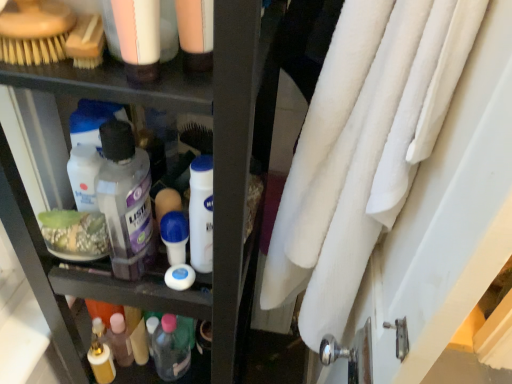
Measure the distance between transparent plastic mouthwash at center and camera.

transparent plastic mouthwash at center and camera are 23.37 inches apart.

This screenshot has width=512, height=384. What do you see at coordinates (362, 149) in the screenshot?
I see `white fluffy towel at right` at bounding box center [362, 149].

What do you see at coordinates (138, 37) in the screenshot? I see `matte plastic lotion at upper left, positioned as the 4th toiletry in bottom-to-top order` at bounding box center [138, 37].

The width and height of the screenshot is (512, 384). In order to click on blue rubber duster at center, which is the third toiletry from top to bottom in this screenshot , I will do `click(175, 236)`.

Image resolution: width=512 pixels, height=384 pixels. I want to click on green matte soap dish at center-left, placed as the second product when sorted from bottom to top, so click(75, 234).

You are a GUI agent. You are given a task and a screenshot of the screen. Output one action in this format:
    pyautogui.click(x=<x>, y=<y>)
    Task: Click on the white matte lotion at center, the 2th toiletry from the front
    Image resolution: width=512 pixels, height=384 pixels.
    Given the screenshot: What is the action you would take?
    pyautogui.click(x=201, y=213)

From the image's perspective, which is below, matte black shelf at center or white glossy deodorant at center, the 1th product from the bottom?

matte black shelf at center.

Considering the sizes of objects matte black shelf at center and white glossy deodorant at center, positioned as the 1th product in right-to-left order, in the image provided, who is thinner, matte black shelf at center or white glossy deodorant at center, positioned as the 1th product in right-to-left order,?

white glossy deodorant at center, positioned as the 1th product in right-to-left order.

Can you tell me how much matte black shelf at center and white glossy deodorant at center, marked as the 2th product in a left-to-right arrangement, differ in facing direction?

matte black shelf at center and white glossy deodorant at center, marked as the 2th product in a left-to-right arrangement, are facing 90.8 degrees away from each other.

I want to click on shelf below the white glossy deodorant at center, the 1th product from the bottom (from a real-world perspective), so click(215, 185).

Is transparent plastic mouthwash at center aimed at blue rubber duster at center, which is the third toiletry from top to bottom?

Yes, transparent plastic mouthwash at center faces towards blue rubber duster at center, which is the third toiletry from top to bottom.

From a real-world perspective, who is located lower, transparent plastic mouthwash at center or blue rubber duster at center, which is counted as the 3th toiletry, starting from the front?

blue rubber duster at center, which is counted as the 3th toiletry, starting from the front, from a real-world perspective.

Who is smaller, transparent plastic mouthwash at center or blue rubber duster at center, the 2th toiletry when ordered from back to front?

Smaller between the two is blue rubber duster at center, the 2th toiletry when ordered from back to front.

From the image's perspective, is transparent plastic mouthwash at center beneath blue rubber duster at center, which is the third toiletry from top to bottom?

No, from the image's perspective, transparent plastic mouthwash at center is not beneath blue rubber duster at center, which is the third toiletry from top to bottom.

Who is smaller, white glossy deodorant at center, the 1th product from the bottom, or blue rubber duster at center, which is counted as the 3th toiletry, starting from the front?

white glossy deodorant at center, the 1th product from the bottom, is smaller.

From the image's perspective, is white glossy deodorant at center, marked as the 2th product in a left-to-right arrangement, located above blue rubber duster at center, the second toiletry in the bottom-to-top sequence?

No, from the image's perspective, white glossy deodorant at center, marked as the 2th product in a left-to-right arrangement, is not on top of blue rubber duster at center, the second toiletry in the bottom-to-top sequence.

Looking at this image, which of these two, white glossy deodorant at center, acting as the 2th product starting from the top, or blue rubber duster at center, which is the third toiletry from top to bottom, stands shorter?

white glossy deodorant at center, acting as the 2th product starting from the top.

Can blue rubber duster at center, the 2th toiletry when ordered from back to front, be found inside white glossy deodorant at center, the 1th product from the bottom?

No, blue rubber duster at center, the 2th toiletry when ordered from back to front, is not a part of white glossy deodorant at center, the 1th product from the bottom.

Does matte black shelf at center lie behind green matte soap dish at center-left, arranged as the first product when viewed from the left?

No, matte black shelf at center is in front of green matte soap dish at center-left, arranged as the first product when viewed from the left.

How many degrees apart are the facing directions of matte black shelf at center and green matte soap dish at center-left, placed as the second product when sorted from bottom to top?

The angular difference between matte black shelf at center and green matte soap dish at center-left, placed as the second product when sorted from bottom to top, is 87.1 degrees.

Between matte black shelf at center and green matte soap dish at center-left, arranged as the first product when viewed from the left, which one has more height?

matte black shelf at center.

How distant is transparent plastic mouthwash at center from matte plastic lotion at upper left, positioned as the 4th toiletry in bottom-to-top order?

They are 24.68 centimeters apart.

From the image's perspective, which is above, transparent plastic mouthwash at center or matte plastic lotion at upper left, the fourth toiletry positioned from the back?

matte plastic lotion at upper left, the fourth toiletry positioned from the back.

Between transparent plastic mouthwash at center and matte plastic lotion at upper left, the first toiletry in the front-to-back sequence, which one is positioned behind?

transparent plastic mouthwash at center is more distant.

Is transparent plastic mouthwash at center aimed at matte plastic lotion at upper left, positioned as the 4th toiletry in bottom-to-top order?

No.

Is matte black shelf at center spatially inside matte plastic lotion at upper left, which appears as the first toiletry when viewed from the top, or outside of it?

The correct answer is: outside.

From the image's perspective, which one is positioned higher, matte black shelf at center or matte plastic lotion at upper left, the first toiletry in the front-to-back sequence?

matte plastic lotion at upper left, the first toiletry in the front-to-back sequence, from the image's perspective.

Is matte black shelf at center to the left of matte plastic lotion at upper left, which appears as the first toiletry when viewed from the top, from the viewer's perspective?

Correct, you'll find matte black shelf at center to the left of matte plastic lotion at upper left, which appears as the first toiletry when viewed from the top.

Based on the photo, between matte black shelf at center and matte plastic lotion at upper left, the first toiletry in the front-to-back sequence, which one is positioned behind?

matte plastic lotion at upper left, the first toiletry in the front-to-back sequence, is further away from the camera.

Which of these two, matte black shelf at center or white fluffy towel at right, is thinner?

white fluffy towel at right.

Would you say white fluffy towel at right is part of matte black shelf at center's contents?

Actually, white fluffy towel at right is outside matte black shelf at center.

Is matte black shelf at center placed right next to white fluffy towel at right?

No, matte black shelf at center is not in contact with white fluffy towel at right.

Could you tell me if matte black shelf at center is turned towards white fluffy towel at right?

Yes.

You are a GUI agent. You are given a task and a screenshot of the screen. Output one action in this format:
    pyautogui.click(x=<x>, y=<y>)
    Task: Click on the shelf below the white glossy deodorant at center, marked as the 2th product in a left-to-right arrangement (from the image's perspective)
    Image resolution: width=512 pixels, height=384 pixels.
    Given the screenshot: What is the action you would take?
    pyautogui.click(x=215, y=185)

The image size is (512, 384). I want to click on mouthwash located on the left of blue rubber duster at center, the 2th toiletry when ordered from back to front, so pyautogui.click(x=126, y=201).

From the image, which object appears to be nearer to green matte soap dish at center-left, arranged as the first product when viewed from the left, white glossy deodorant at center, marked as the 2th product in a left-to-right arrangement, or white matte lotion at center, the 2th toiletry from the front?

Based on the image, white glossy deodorant at center, marked as the 2th product in a left-to-right arrangement, appears to be nearer to green matte soap dish at center-left, arranged as the first product when viewed from the left.

From the image, which object appears to be nearer to matte black shelf at center, white glossy deodorant at center, marked as the 2th product in a left-to-right arrangement, or transparent plastic mouthwash at center?

Among the two, transparent plastic mouthwash at center is located nearer to matte black shelf at center.

Looking at the image, which one is located further to blue rubber duster at center, which is the third toiletry from top to bottom, white glossy deodorant at center, marked as the 2th product in a left-to-right arrangement, or translucent plastic bottle at lower center, arranged as the 1th toiletry when ordered from the bottom?

translucent plastic bottle at lower center, arranged as the 1th toiletry when ordered from the bottom, is further to blue rubber duster at center, which is the third toiletry from top to bottom.

Considering their positions, is white fluffy towel at right positioned further to white glossy deodorant at center, acting as the 2th product starting from the top, than white matte lotion at center, the third toiletry when ordered from back to front?

white fluffy towel at right.

From the image, which object appears to be nearer to white glossy deodorant at center, positioned as the 1th product in right-to-left order, white fluffy towel at right or transparent plastic mouthwash at center?

Based on the image, transparent plastic mouthwash at center appears to be nearer to white glossy deodorant at center, positioned as the 1th product in right-to-left order.

Considering their positions, is blue rubber duster at center, the 2th toiletry when ordered from back to front, positioned further to white glossy deodorant at center, acting as the 2th product starting from the top, than matte plastic lotion at upper left, the fourth toiletry positioned from the back?

matte plastic lotion at upper left, the fourth toiletry positioned from the back, is further to white glossy deodorant at center, acting as the 2th product starting from the top.

Based on their spatial positions, is matte plastic lotion at upper left, positioned as the 4th toiletry in bottom-to-top order, or transparent plastic mouthwash at center closer to white fluffy towel at right?

transparent plastic mouthwash at center is closer to white fluffy towel at right.

In the scene shown: Considering their positions, is blue rubber duster at center, which is counted as the 3th toiletry, starting from the front, positioned closer to white glossy deodorant at center, marked as the 2th product in a left-to-right arrangement, than white fluffy towel at right?

blue rubber duster at center, which is counted as the 3th toiletry, starting from the front, is positioned closer to the anchor white glossy deodorant at center, marked as the 2th product in a left-to-right arrangement.

Locate an element on the screen. The image size is (512, 384). mouthwash between matte plastic lotion at upper left, the fourth toiletry positioned from the back, and matte black shelf at center vertically is located at coordinates (126, 201).

Locate an element on the screen. shelf between white fluffy towel at right and translucent plastic bottle at lower center, acting as the fourth toiletry starting from the front, in the front-back direction is located at coordinates (215, 185).

At what (x,y) coordinates should I click in order to perform the action: click on mouthwash situated between green matte soap dish at center-left, arranged as the first product when viewed from the left, and blue rubber duster at center, which is counted as the 3th toiletry, starting from the front, from left to right. Please return your answer as a coordinate pair (x, y). The height and width of the screenshot is (384, 512). Looking at the image, I should click on (126, 201).

This screenshot has height=384, width=512. What are the coordinates of `mouthwash between matte black shelf at center and blue rubber duster at center, the second toiletry in the bottom-to-top sequence, along the z-axis` in the screenshot? It's located at (126, 201).